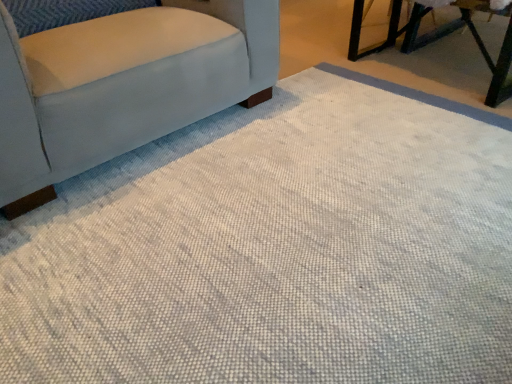
What do you see at coordinates (122, 85) in the screenshot?
I see `light gray fabric chair at left` at bounding box center [122, 85].

This screenshot has height=384, width=512. I want to click on light gray fabric chair at left, so click(x=122, y=85).

Locate an element on the screen. The image size is (512, 384). metallic green table at upper right is located at coordinates (439, 38).

Measure the distance between point (351, 28) and camera.

Point (351, 28) is 8.80 feet away from camera.

This screenshot has height=384, width=512. Describe the element at coordinates (439, 38) in the screenshot. I see `metallic green table at upper right` at that location.

This screenshot has width=512, height=384. Identify the location of light gray fabric chair at left. (122, 85).

Which is more to the left, light gray fabric chair at left or metallic green table at upper right?

Positioned to the left is light gray fabric chair at left.

Looking at this image, relative to metallic green table at upper right, is light gray fabric chair at left in front or behind?

Clearly, light gray fabric chair at left is in front of metallic green table at upper right.

Is point (104, 101) positioned in front of point (511, 92)?

Yes, point (104, 101) is closer to viewer.

From the image's perspective, would you say light gray fabric chair at left is positioned over metallic green table at upper right?

No, from the image's perspective, light gray fabric chair at left is not over metallic green table at upper right.

Looking at this image, from a real-world perspective, is light gray fabric chair at left beneath metallic green table at upper right?

No, from a real-world perspective, light gray fabric chair at left is not under metallic green table at upper right.

Is light gray fabric chair at left wider or thinner than metallic green table at upper right?

Clearly, light gray fabric chair at left has more width compared to metallic green table at upper right.

Considering the sizes of objects light gray fabric chair at left and metallic green table at upper right in the image provided, who is shorter, light gray fabric chair at left or metallic green table at upper right?

metallic green table at upper right is shorter.

Can you confirm if light gray fabric chair at left is bigger than metallic green table at upper right?

Yes, light gray fabric chair at left is bigger than metallic green table at upper right.

Would you say metallic green table at upper right is part of light gray fabric chair at left's contents?

No, light gray fabric chair at left does not contain metallic green table at upper right.

Are light gray fabric chair at left and metallic green table at upper right far apart?

Yes.

Does light gray fabric chair at left turn towards metallic green table at upper right?

No, light gray fabric chair at left is not aimed at metallic green table at upper right.

Measure the distance between light gray fabric chair at left and metallic green table at upper right.

They are 4.31 feet apart.

Locate an element on the screen. chair below the metallic green table at upper right (from the image's perspective) is located at coordinates pyautogui.click(x=122, y=85).

Which is more to the right, metallic green table at upper right or light gray fabric chair at left?

metallic green table at upper right is more to the right.

Which is behind, metallic green table at upper right or light gray fabric chair at left?

metallic green table at upper right.

Is point (426, 8) less distant than point (66, 98)?

No, (426, 8) is further to viewer.

From the image's perspective, is metallic green table at upper right above light gray fabric chair at left?

Indeed, from the image's perspective, metallic green table at upper right is shown above light gray fabric chair at left.

From a real-world perspective, which object rests below the other?

metallic green table at upper right.

Consider the image. Considering the sizes of objects metallic green table at upper right and light gray fabric chair at left in the image provided, who is wider, metallic green table at upper right or light gray fabric chair at left?

light gray fabric chair at left.

Between metallic green table at upper right and light gray fabric chair at left, which one has less height?

With less height is metallic green table at upper right.

Consider the image. Looking at the image, does metallic green table at upper right seem bigger or smaller compared to light gray fabric chair at left?

metallic green table at upper right is smaller than light gray fabric chair at left.

From the picture: Is metallic green table at upper right situated inside light gray fabric chair at left or outside?

metallic green table at upper right cannot be found inside light gray fabric chair at left.

Is metallic green table at upper right with light gray fabric chair at left?

metallic green table at upper right and light gray fabric chair at left are not in contact.

Is metallic green table at upper right aimed at light gray fabric chair at left?

Yes, metallic green table at upper right is turned towards light gray fabric chair at left.

How different are the orientations of metallic green table at upper right and light gray fabric chair at left in degrees?

94.1 degrees separate the facing orientations of metallic green table at upper right and light gray fabric chair at left.

Locate an element on the screen. The height and width of the screenshot is (384, 512). table behind the light gray fabric chair at left is located at coordinates (439, 38).

Locate an element on the screen. chair on the left of metallic green table at upper right is located at coordinates (122, 85).

Locate an element on the screen. Image resolution: width=512 pixels, height=384 pixels. chair above the metallic green table at upper right (from a real-world perspective) is located at coordinates (122, 85).